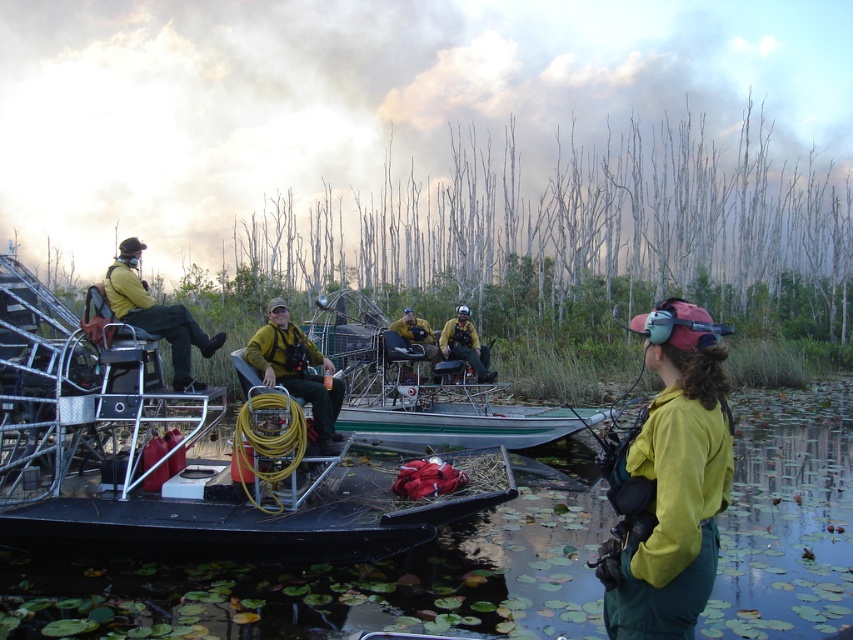
You are a researcher who needs to reach the metallic yellow boat at center located at point (x=177, y=456). Can you confirm if the boat is positioned at that coordinate?

Yes, the metallic yellow boat at center is located at point (x=177, y=456).

You are a researcher planning to place a new sensor on the metallic yellow boat at center. According to the coordinates provided, where exactly should the sensor be placed on the boat?

The metallic yellow boat at center is located at point coordinates [177,456], so the sensor should be placed at those coordinates on the boat.

You are a researcher preparing to board the metallic yellow boat at center. You are currently wearing the yellow matte uniform at center. If the boat has a narrow entrance, will your uniform fit through it comfortably?

The metallic yellow boat at center is wider than the yellow matte uniform at center, so the uniform should fit through the boat entrance comfortably.